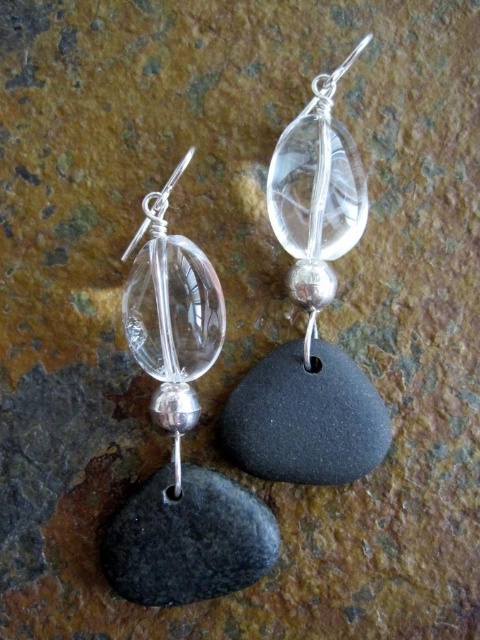
Identify the location of clear glass stone at lower left. click(180, 435).

Between point (252, 502) and point (368, 403), which one is positioned behind?

The point (368, 403) is more distant.

Who is more distant from viewer, (130,314) or (279,424)?

Point (130,314)

Locate an element on the screen. The image size is (480, 640). clear glass stone at lower left is located at coordinates (180, 435).

Is clear glass stone at lower left positioned in front of black matte stone at lower left?

No, clear glass stone at lower left is behind black matte stone at lower left.

Does clear glass stone at lower left have a greater width compared to black matte stone at lower left?

No, clear glass stone at lower left is not wider than black matte stone at lower left.

Which is in front, point (223, 326) or point (273, 536)?

Point (273, 536) is more forward.

Locate an element on the screen. clear glass stone at lower left is located at coordinates (180, 435).

How far apart are clear glass stone at center and black matte stone at center?

clear glass stone at center is 1.90 inches from black matte stone at center.

Identify the location of clear glass stone at center. Image resolution: width=480 pixels, height=640 pixels. (310, 316).

Who is more forward, (312, 392) or (360, 432)?

Point (360, 432) is in front.

I want to click on clear glass stone at center, so click(310, 316).